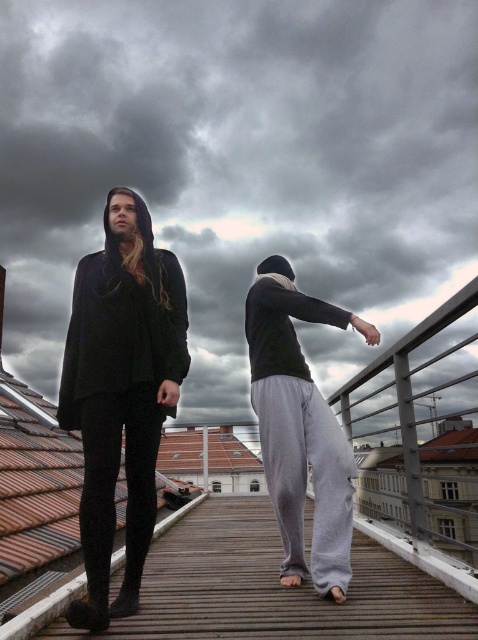
Is matte black cape at left below gray sweatpants at center?

Actually, matte black cape at left is above gray sweatpants at center.

Can you confirm if matte black cape at left is positioned to the right of gray sweatpants at center?

No, matte black cape at left is not to the right of gray sweatpants at center.

You are a GUI agent. You are given a task and a screenshot of the screen. Output one action in this format:
    pyautogui.click(x=<x>, y=<y>)
    Task: Click on the matte black cape at left
    The image size is (478, 640).
    Given the screenshot: What is the action you would take?
    point(120,392)

Where is `matte black cape at left`? The image size is (478, 640). matte black cape at left is located at coordinates (120, 392).

Which of these two, matte black hoodie at center or matte black cape at left, stands taller?

Standing taller between the two is matte black hoodie at center.

Does matte black hoodie at center have a lesser width compared to matte black cape at left?

Correct, matte black hoodie at center's width is less than matte black cape at left's.

Locate an element on the screen. matte black hoodie at center is located at coordinates (120, 392).

This screenshot has width=478, height=640. Identify the location of matte black hoodie at center. (120, 392).

Between point (82, 356) and point (300, 452), which one is positioned behind?

Point (300, 452)

Which is behind, point (76, 605) or point (330, 534)?

The point (330, 534) is behind.

I want to click on matte black hoodie at center, so click(x=120, y=392).